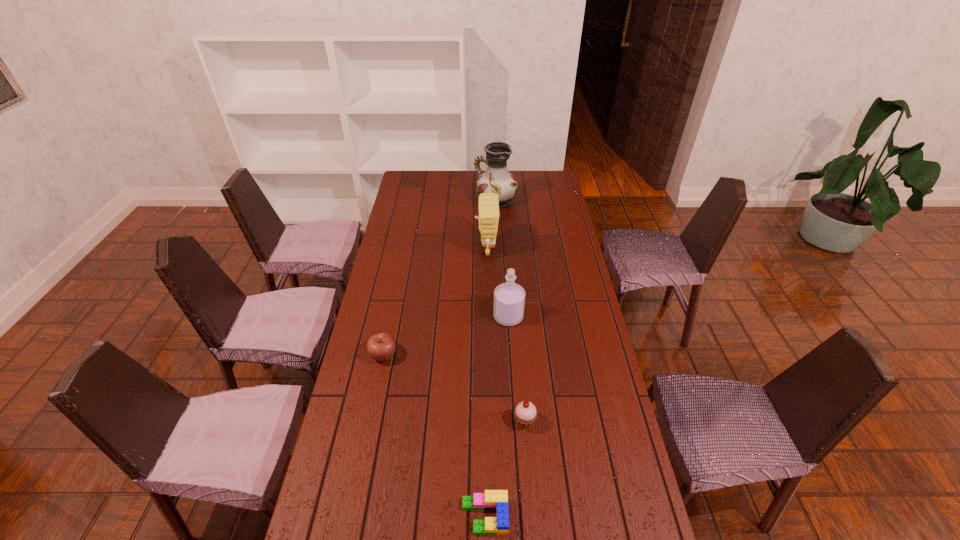
Image resolution: width=960 pixels, height=540 pixels. In order to click on the farthest object in this screenshot , I will do `click(497, 179)`.

The height and width of the screenshot is (540, 960). In order to click on the tallest object in this screenshot , I will do `click(497, 179)`.

Image resolution: width=960 pixels, height=540 pixels. Find the location of `sponge`. sponge is located at coordinates (489, 214).

You are a GUI agent. You are given a task and a screenshot of the screen. Output one action in this format:
    pyautogui.click(x=<x>, y=<y>)
    Task: Click on the perfume
    The width and height of the screenshot is (960, 540).
    Given the screenshot: What is the action you would take?
    pyautogui.click(x=509, y=298)

In order to click on cupcake in this screenshot , I will do `click(525, 414)`.

This screenshot has width=960, height=540. In order to click on the second nearest object in this screenshot , I will do `click(525, 414)`.

The image size is (960, 540). I want to click on the leftmost object, so click(x=381, y=347).

You are a GUI agent. You are given a task and a screenshot of the screen. Output one action in this format:
    pyautogui.click(x=<x>, y=<y>)
    Task: Click on the apple
    This screenshot has height=540, width=960.
    Given the screenshot: What is the action you would take?
    pyautogui.click(x=381, y=347)

The width and height of the screenshot is (960, 540). What are the coordinates of `Lego` in the screenshot? It's located at (497, 500).

Locate an element on the screen. the shortest object is located at coordinates (497, 500).